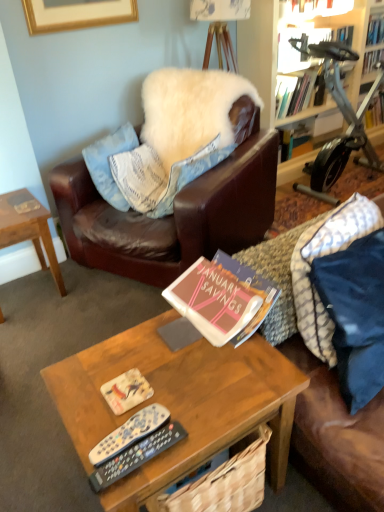
In order to click on free location to the right of black plastic remote at center, the first remote control viewed from the front in this screenshot , I will do `click(209, 423)`.